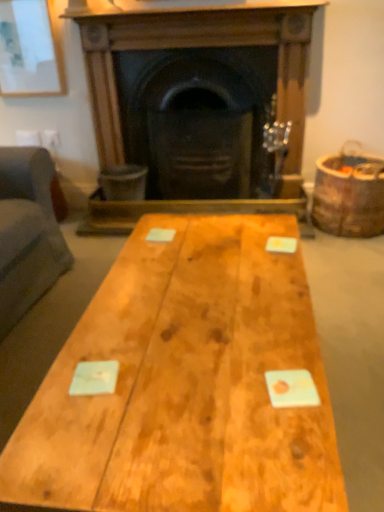
Question: Is brown wooden barrel at right outside of matte white picture frame at upper left?

Choices:
 (A) yes
 (B) no

Answer: (A)

Question: Considering the relative positions of brown wooden barrel at right and matte white picture frame at upper left in the image provided, is brown wooden barrel at right to the left of matte white picture frame at upper left from the viewer's perspective?

Choices:
 (A) yes
 (B) no

Answer: (B)

Question: Does brown wooden barrel at right come in front of matte white picture frame at upper left?

Choices:
 (A) yes
 (B) no

Answer: (A)

Question: From a real-world perspective, is brown wooden barrel at right located higher than matte white picture frame at upper left?

Choices:
 (A) yes
 (B) no

Answer: (B)

Question: Can you confirm if brown wooden barrel at right is wider than matte white picture frame at upper left?

Choices:
 (A) yes
 (B) no

Answer: (A)

Question: From the image's perspective, is matte white picture frame at upper left above or below wooden fireplace at center?

Choices:
 (A) below
 (B) above

Answer: (B)

Question: Would you say matte white picture frame at upper left is to the left or to the right of wooden fireplace at center in the picture?

Choices:
 (A) right
 (B) left

Answer: (B)

Question: Is matte white picture frame at upper left wider or thinner than wooden fireplace at center?

Choices:
 (A) wide
 (B) thin

Answer: (B)

Question: Considering their positions, is matte white picture frame at upper left located in front of or behind wooden fireplace at center?

Choices:
 (A) front
 (B) behind

Answer: (B)

Question: Is wooden fireplace at center in front of or behind brown wooden barrel at right in the image?

Choices:
 (A) behind
 (B) front

Answer: (A)

Question: Does point (263, 32) appear closer or farther from the camera than point (365, 176)?

Choices:
 (A) closer
 (B) farther

Answer: (B)

Question: In the image, is wooden fireplace at center on the left side or the right side of brown wooden barrel at right?

Choices:
 (A) left
 (B) right

Answer: (A)

Question: Is wooden fireplace at center wider or thinner than brown wooden barrel at right?

Choices:
 (A) thin
 (B) wide

Answer: (A)

Question: From a real-world perspective, relative to brown wooden barrel at right, is natural wood table at center vertically above or below?

Choices:
 (A) below
 (B) above

Answer: (A)

Question: Considering the positions of natural wood table at center and brown wooden barrel at right in the image, is natural wood table at center bigger or smaller than brown wooden barrel at right?

Choices:
 (A) small
 (B) big

Answer: (B)